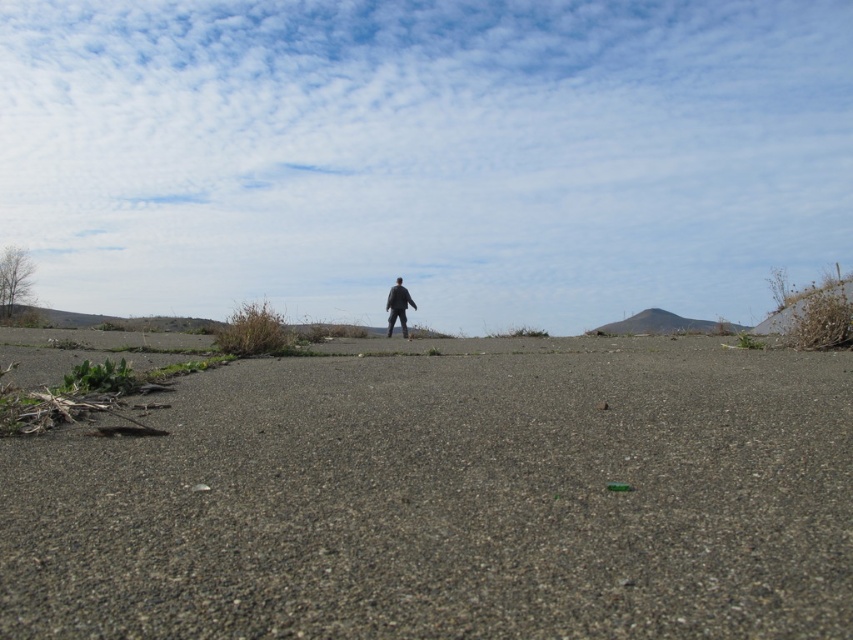
Question: Can you confirm if gray gravelly dirt at center is positioned below black matte jacket at center?

Choices:
 (A) yes
 (B) no

Answer: (A)

Question: Which of the following is the farthest from the observer?

Choices:
 (A) (344, 404)
 (B) (399, 294)

Answer: (B)

Question: Is gray gravelly dirt at center closer to the viewer compared to black matte jacket at center?

Choices:
 (A) no
 (B) yes

Answer: (B)

Question: In this image, where is gray gravelly dirt at center located relative to black matte jacket at center?

Choices:
 (A) below
 (B) above

Answer: (A)

Question: Which object is farther from the camera taking this photo?

Choices:
 (A) black matte jacket at center
 (B) gray gravelly dirt at center

Answer: (A)